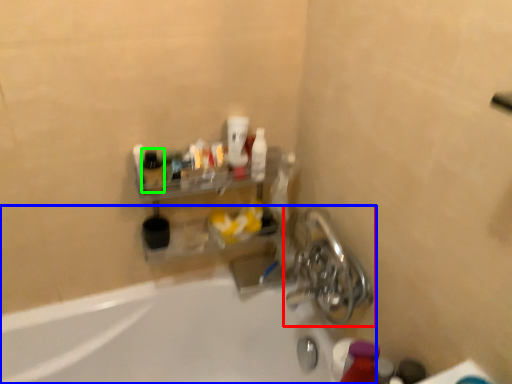
Question: Estimate the real-world distances between objects in this image. Which object is farther from tap (highlighted by a red box), bathtub (highlighted by a blue box) or bottle (highlighted by a green box)?

Choices:
 (A) bathtub
 (B) bottle

Answer: (B)